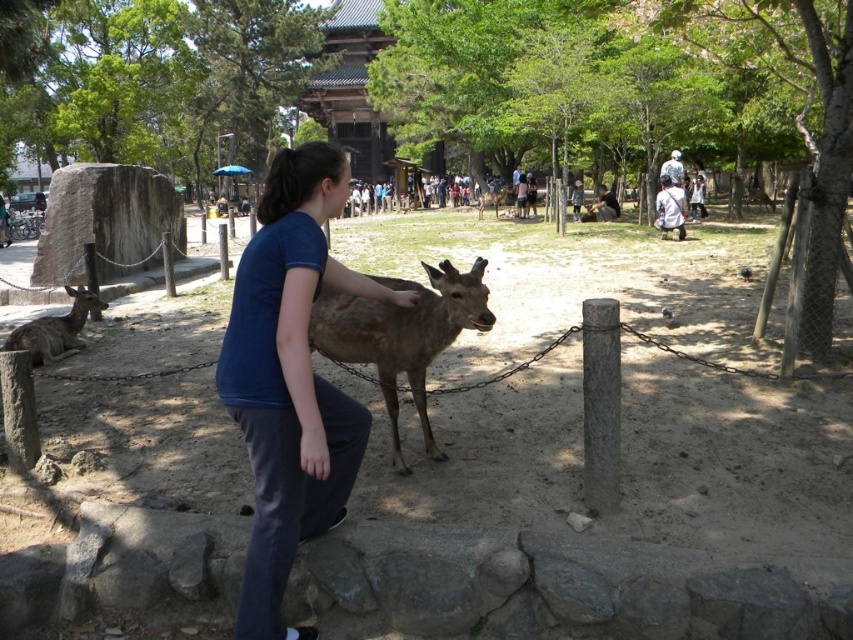
Question: Which point appears farthest from the camera in this image?

Choices:
 (A) (13, 330)
 (B) (436, 312)

Answer: (A)

Question: From the image, what is the correct spatial relationship of blue cotton shirt at center in relation to brown matte deer at center?

Choices:
 (A) left
 (B) right

Answer: (A)

Question: Which object appears closest to the camera in this image?

Choices:
 (A) brown matte deer at center
 (B) brown matte/deer at center

Answer: (B)

Question: Does blue cotton shirt at center appear on the left side of brown matte/deer at center?

Choices:
 (A) yes
 (B) no

Answer: (A)

Question: Which point appears farthest from the camera in this image?

Choices:
 (A) (482, 209)
 (B) (42, 321)
 (C) (323, 458)
 (D) (421, 416)

Answer: (A)

Question: In this image, where is brown fur deer at left located relative to brown matte deer at center?

Choices:
 (A) above
 (B) below

Answer: (B)